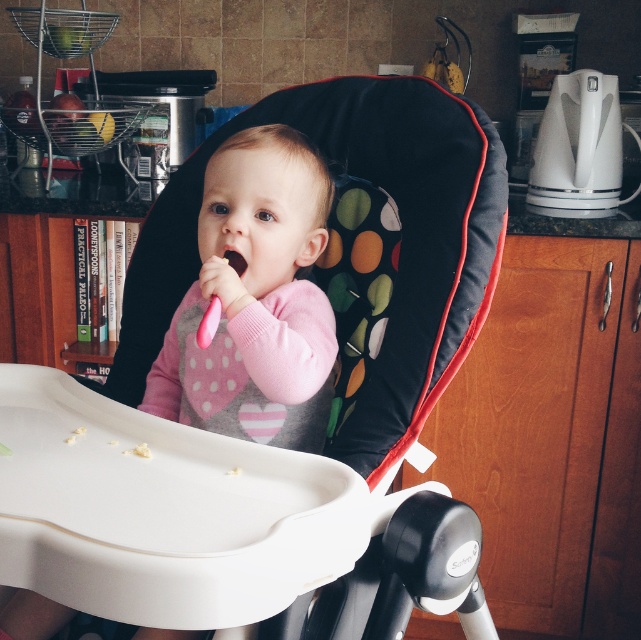
Question: Estimate the real-world distances between objects in this image. Which object is farther from the pink soft toy at center?

Choices:
 (A) pink rubber toothbrush at center
 (B) black fabric highchair at center

Answer: (B)

Question: Which point is farther to the camera?

Choices:
 (A) pink soft toy at center
 (B) black fabric highchair at center
 (C) pink rubber toothbrush at center

Answer: (C)

Question: Does black fabric highchair at center have a larger size compared to pink rubber toothbrush at center?

Choices:
 (A) yes
 (B) no

Answer: (A)

Question: Does black fabric highchair at center appear on the left side of pink rubber toothbrush at center?

Choices:
 (A) no
 (B) yes

Answer: (A)

Question: Considering the real-world distances, which object is farthest from the pink soft toy at center?

Choices:
 (A) pink rubber toothbrush at center
 (B) black fabric highchair at center

Answer: (B)

Question: Can you confirm if black fabric highchair at center is positioned to the left of pink rubber toothbrush at center?

Choices:
 (A) yes
 (B) no

Answer: (B)